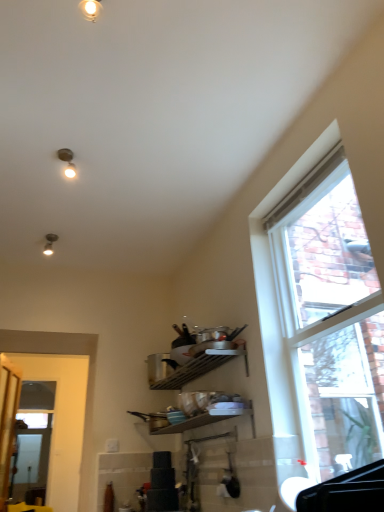
Question: Is clear glass window at right situated inside matte white light fixture at upper center, acting as the first light fixture starting from the front, or outside?

Choices:
 (A) outside
 (B) inside

Answer: (A)

Question: Is clear glass window at right wider or thinner than matte white light fixture at upper center, which ranks as the 2th light fixture in left-to-right order?

Choices:
 (A) wide
 (B) thin

Answer: (A)

Question: Estimate the real-world distances between objects in this image. Which object is farther from the matte silver light fixture at upper left, the 2th light fixture positioned from the right?

Choices:
 (A) matte white light fixture at upper center, which appears as the first light fixture when viewed from the top
 (B) clear glass window at right
 (C) clear glass screen door at left
 (D) white glossy door at left

Answer: (C)

Question: Which object is the farthest from the white glossy door at left?

Choices:
 (A) clear glass screen door at left
 (B) clear glass window at right
 (C) matte silver light fixture at upper left, which is the second light fixture from front to back
 (D) matte white light fixture at upper center, arranged as the second light fixture when ordered from the bottom

Answer: (D)